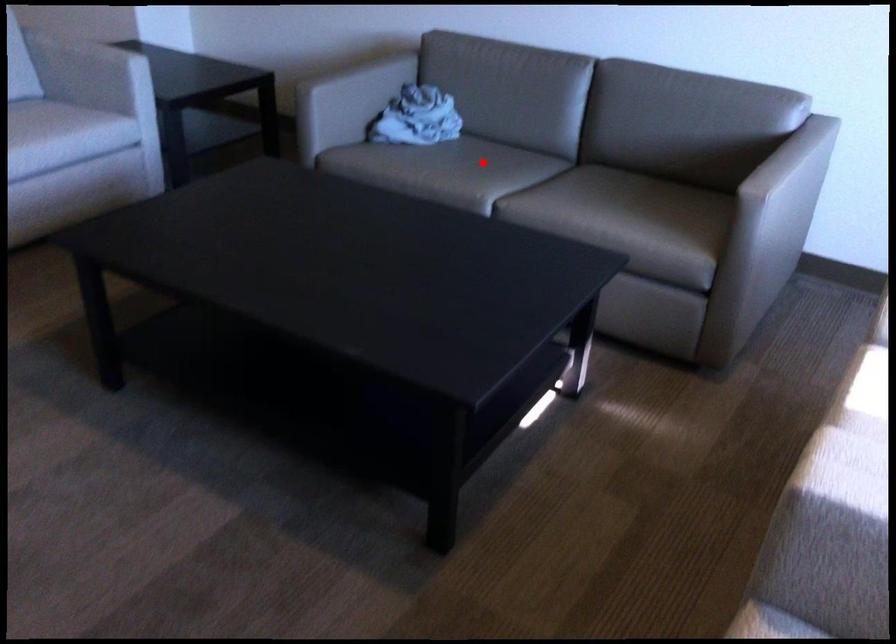
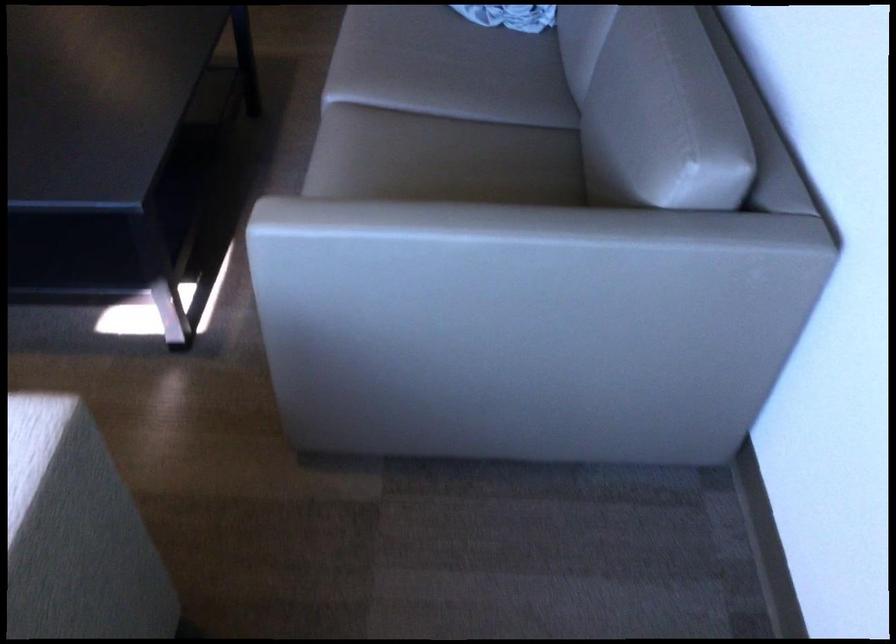
Question: I am providing you with two images of the same scene from different viewpoints. Image1 has a red point marked. In image2, the corresponding 3D location appears at what relative position? Reply with the corresponding letter.

Choices:
 (A) Closer
 (B) Farther

Answer: (A)